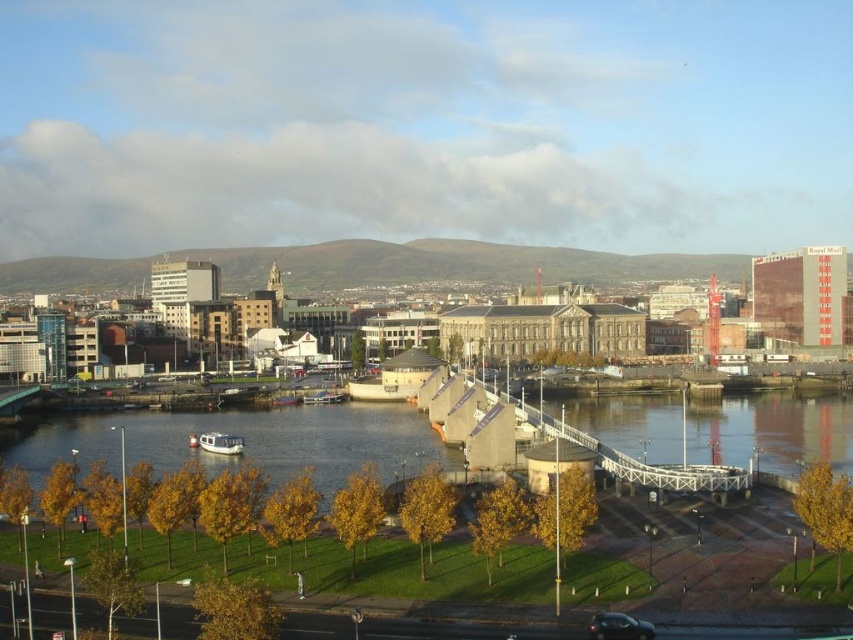
You are a pedestrian trying to cross the white wooden bridge at center. There is a shiny black car at bottom right parked nearby. Can you safely walk on the bridge without worrying about the car blocking your path?

The white wooden bridge at center might be wider than shiny black car at bottom right, so it is possible that the bridge has enough space for pedestrians to walk safely without obstruction from the car.

In the scene shown: You are a photographer standing at the waterfront, and you want to capture a photo that includes both the clear water at lower center and the shiny black car at bottom right. Which object will appear larger in the photo?

The clear water at lower center will appear larger in the photo because it is much taller than the shiny black car at bottom right.

You are a photographer planning to capture the white wooden bridge at center and the clear water at lower center in a single shot. Based on their positions, which one would appear closer to the camera in the final photograph?

The clear water at lower center would appear closer to the camera because the white wooden bridge at center is behind it.